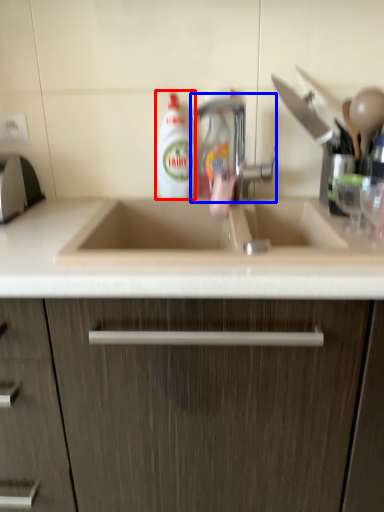
Question: Which object appears farthest to the camera in this image, cleaning product (highlighted by a red box) or tap (highlighted by a blue box)?

Choices:
 (A) cleaning product
 (B) tap

Answer: (A)